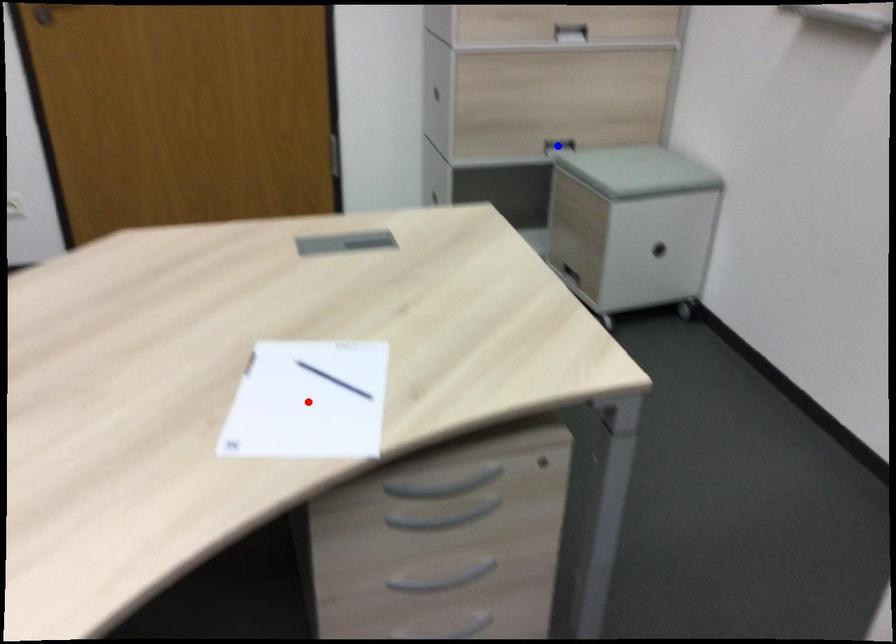
Question: Two points are marked on the image. Which point is closer to the camera?

Choices:
 (A) Blue point is closer.
 (B) Red point is closer.

Answer: (B)